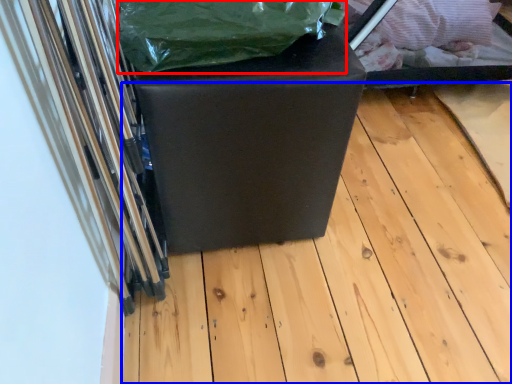
Question: Which point is closer to the camera, waste (highlighted by a red box) or wood (highlighted by a blue box)?

Choices:
 (A) waste
 (B) wood

Answer: (A)